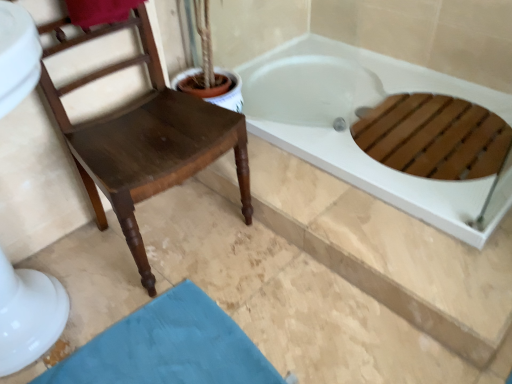
Find the location of `free location above teal fabric bath mat at lower left (from a real-world perspective)`. free location above teal fabric bath mat at lower left (from a real-world perspective) is located at coordinates (164, 352).